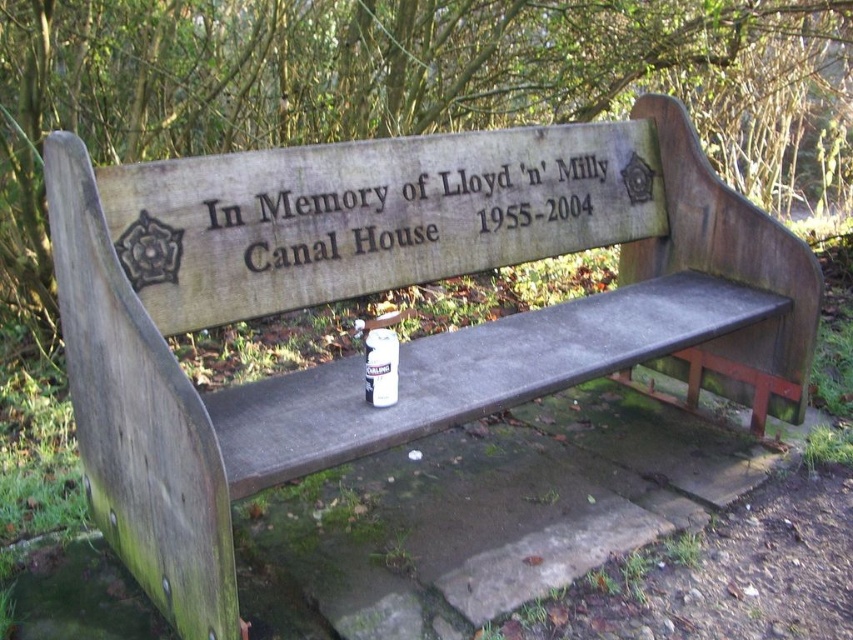
You are standing in front of the wooden bench and want to place a small object on the seat. The first point you consider is point (363, 230) and the second is point (376, 346). Which point is closer to you when looking at the bench?

Point (363, 230) is further to the camera than point (376, 346). Therefore, point (376, 346) is closer to you when looking at the bench.

You are a park visitor who wants to place a small item on the wooden bench. You notice the black engraved text at center and the white matte can at center. Which object is located to the left of the other?

The black engraved text at center is positioned on the right side of white matte can at center, so the white matte can at center is to the left of the black engraved text at center.